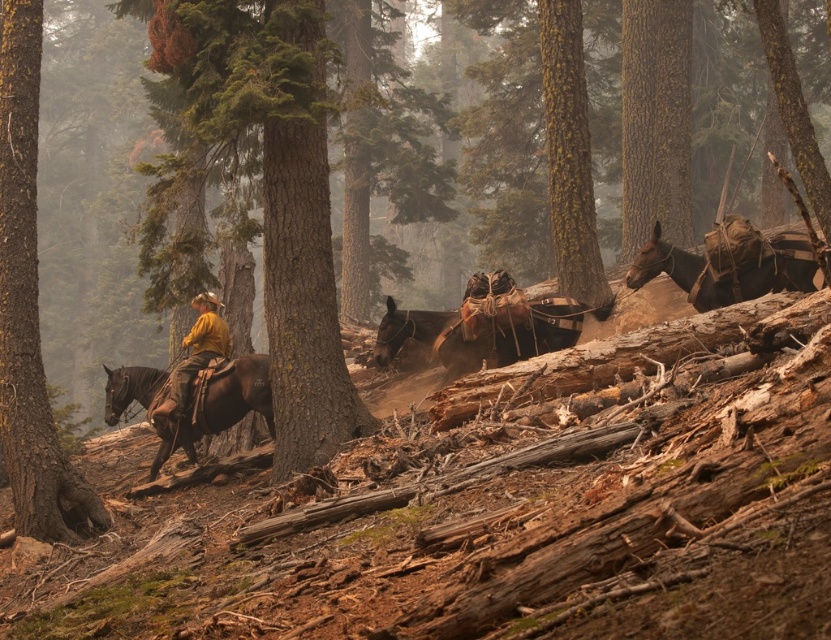
Based on the photo, who is taller, brown leather horse at center or dark brown leather horse at left?

dark brown leather horse at left is taller.

In the scene shown: Which of these two, brown leather horse at center or dark brown leather horse at left, stands shorter?

brown leather horse at center is shorter.

Where is `brown leather horse at center`? This screenshot has width=831, height=640. brown leather horse at center is located at coordinates (480, 332).

Is smooth bark tree at center smaller than brown leather horse at right?

Yes.

The width and height of the screenshot is (831, 640). What do you see at coordinates (569, 156) in the screenshot?
I see `smooth bark tree at center` at bounding box center [569, 156].

Between point (564, 275) and point (765, 273), which one is positioned in front?

Point (765, 273)

Find the location of a particular element. smooth bark tree at center is located at coordinates (569, 156).

Is point (175, 435) behind point (173, 376)?

No.

Does dark brown leather horse at left have a greater width compared to yellow matte shirt at left?

Yes, dark brown leather horse at left is wider than yellow matte shirt at left.

Is point (261, 406) positioned before point (194, 328)?

Yes, it is.

Identify the location of dark brown leather horse at left. The height and width of the screenshot is (640, 831). (193, 401).